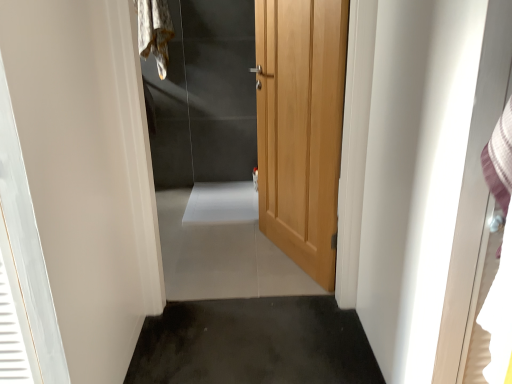
Question: Does fuzzy fabric laundry at upper left lie behind white glossy screen door at right?

Choices:
 (A) no
 (B) yes

Answer: (B)

Question: Is fuzzy fabric laundry at upper left at the right side of white glossy screen door at right?

Choices:
 (A) no
 (B) yes

Answer: (A)

Question: Is fuzzy fabric laundry at upper left in contact with white glossy screen door at right?

Choices:
 (A) no
 (B) yes

Answer: (A)

Question: Is fuzzy fabric laundry at upper left facing towards white glossy screen door at right?

Choices:
 (A) yes
 (B) no

Answer: (B)

Question: Does fuzzy fabric laundry at upper left have a greater width compared to white glossy screen door at right?

Choices:
 (A) yes
 (B) no

Answer: (B)

Question: Considering the relative positions of fuzzy fabric laundry at upper left and white glossy screen door at right in the image provided, is fuzzy fabric laundry at upper left in front of white glossy screen door at right?

Choices:
 (A) yes
 (B) no

Answer: (B)

Question: Is fuzzy fabric laundry at upper left touching wooden door at center?

Choices:
 (A) yes
 (B) no

Answer: (B)

Question: Can you confirm if fuzzy fabric laundry at upper left is wider than wooden door at center?

Choices:
 (A) no
 (B) yes

Answer: (B)

Question: Is fuzzy fabric laundry at upper left shorter than wooden door at center?

Choices:
 (A) yes
 (B) no

Answer: (A)

Question: From a real-world perspective, is fuzzy fabric laundry at upper left on wooden door at center?

Choices:
 (A) yes
 (B) no

Answer: (A)

Question: From the image's perspective, is fuzzy fabric laundry at upper left beneath wooden door at center?

Choices:
 (A) yes
 (B) no

Answer: (B)

Question: Is fuzzy fabric laundry at upper left smaller than wooden door at center?

Choices:
 (A) yes
 (B) no

Answer: (A)

Question: Is white glossy screen door at right bigger than light wood door at center?

Choices:
 (A) no
 (B) yes

Answer: (A)